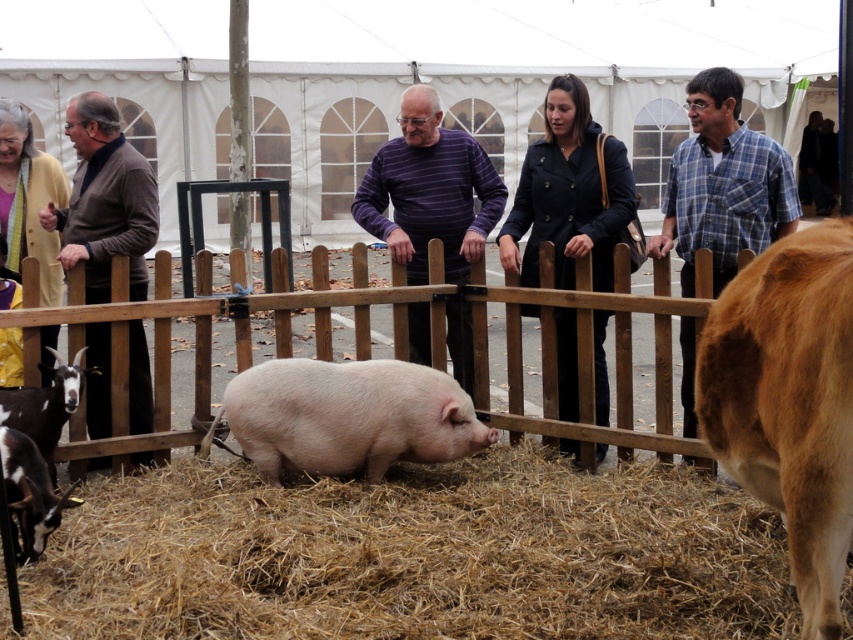
Between wooden fence at center and dark blue coat at center, which one has more height?

dark blue coat at center is taller.

Describe the element at coordinates (402, 344) in the screenshot. I see `wooden fence at center` at that location.

The width and height of the screenshot is (853, 640). Identify the location of wooden fence at center. (x=402, y=344).

Can you confirm if pink matte pig at center is thinner than blue plaid shirt at right?

No.

Measure the distance between pink matte pig at center and camera.

pink matte pig at center is 5.30 meters away from camera.

Who is more forward, (x=419, y=435) or (x=718, y=92)?

Point (x=419, y=435)

Where is `pink matte pig at center`? Image resolution: width=853 pixels, height=640 pixels. pink matte pig at center is located at coordinates (346, 417).

Who is more distant from viewer, [48,522] or [65,400]?

The point [65,400] is more distant.

Is light pink matte pig at lower left positioned before black and white fur goat at lower left?

That is True.

Between point (44, 520) and point (44, 445), which one is positioned behind?

The point (44, 445) is more distant.

At what (x,y) coordinates should I click in order to perform the action: click on light pink matte pig at lower left. Please return your answer as a coordinate pair (x, y). Looking at the image, I should click on (30, 493).